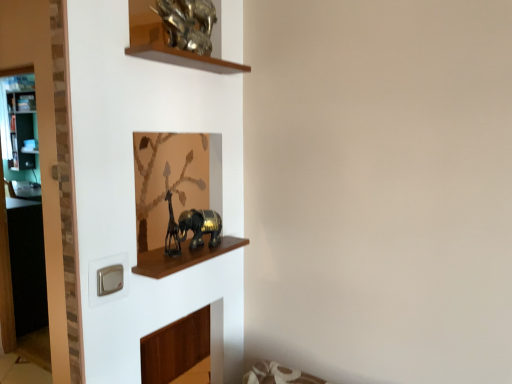
Measure the distance between point (153, 276) and camera.

Point (153, 276) and camera are 1.36 meters apart.

This screenshot has width=512, height=384. Describe the element at coordinates (182, 257) in the screenshot. I see `shiny brown cabinet at center` at that location.

What is the approximate width of gold metallic sculpture at upper center, which is the second animal in bottom-to-top order?

5.25 inches.

What do you see at coordinates (22, 221) in the screenshot? I see `transparent glass door at left` at bounding box center [22, 221].

You are a GUI agent. You are given a task and a screenshot of the screen. Output one action in this format:
    pyautogui.click(x=<x>, y=<y>)
    Task: Click on the shiny brown cabinet at center
    The width and height of the screenshot is (512, 384).
    Given the screenshot: What is the action you would take?
    pyautogui.click(x=182, y=257)

Can you tell me how much transparent glass door at left and shiny brown cabinet at center differ in facing direction?

89.6 degrees separate the facing orientations of transparent glass door at left and shiny brown cabinet at center.

Is transparent glass door at left positioned with its back to shiny brown cabinet at center?

Result: No, transparent glass door at left's orientation is not away from shiny brown cabinet at center.

Which is behind, transparent glass door at left or shiny brown cabinet at center?

transparent glass door at left is further from the camera.

From a real-world perspective, is transparent glass door at left under shiny brown cabinet at center?

Yes, from a real-world perspective, transparent glass door at left is beneath shiny brown cabinet at center.

Is transparent glass door at left spatially inside gold metallic sculpture at upper center, which is the second animal in bottom-to-top order, or outside of it?

transparent glass door at left exists outside the volume of gold metallic sculpture at upper center, which is the second animal in bottom-to-top order.

Is transparent glass door at left far from gold metallic sculpture at upper center, which is the second animal in bottom-to-top order?

Yes, transparent glass door at left and gold metallic sculpture at upper center, which is the second animal in bottom-to-top order, are located far from each other.

From the image's perspective, is transparent glass door at left positioned above or below gold metallic sculpture at upper center, which ranks as the 1th animal in top-to-bottom order?

transparent glass door at left is situated lower than gold metallic sculpture at upper center, which ranks as the 1th animal in top-to-bottom order, in the image.

Considering the sizes of objects transparent glass door at left and gold metallic sculpture at upper center, which is the second animal in bottom-to-top order, in the image provided, who is wider, transparent glass door at left or gold metallic sculpture at upper center, which is the second animal in bottom-to-top order,?

transparent glass door at left.

From the picture: Which of these two, shiny brown cabinet at center or gold metallic sculpture at upper center, which ranks as the 1th animal in top-to-bottom order, is wider?

Wider between the two is gold metallic sculpture at upper center, which ranks as the 1th animal in top-to-bottom order.

Is shiny brown cabinet at center bigger than gold metallic sculpture at upper center, which is the second animal in bottom-to-top order?

No, shiny brown cabinet at center is not bigger than gold metallic sculpture at upper center, which is the second animal in bottom-to-top order.

Based on the photo, is shiny brown cabinet at center positioned with its back to gold metallic sculpture at upper center, which is the second animal in bottom-to-top order?

That's not correct — shiny brown cabinet at center is not looking away from gold metallic sculpture at upper center, which is the second animal in bottom-to-top order.

How far apart are shiny brown cabinet at center and gold metallic sculpture at upper center, which is the second animal in bottom-to-top order?

28.27 inches.

From the picture: How far apart are gold metallic elephant at center, the second animal positioned from the top, and gold metallic sculpture at upper center, which is the second animal in bottom-to-top order?

62.12 centimeters.

Does gold metallic elephant at center, acting as the 1th animal starting from the bottom, have a lesser width compared to gold metallic sculpture at upper center, which ranks as the 1th animal in top-to-bottom order?

Yes.

Is the surface of gold metallic elephant at center, the second animal positioned from the top, in direct contact with gold metallic sculpture at upper center, which ranks as the 1th animal in top-to-bottom order?

gold metallic elephant at center, the second animal positioned from the top, and gold metallic sculpture at upper center, which ranks as the 1th animal in top-to-bottom order, are clearly separated.

From a real-world perspective, is gold metallic elephant at center, the second animal positioned from the top, on gold metallic sculpture at upper center, which is the second animal in bottom-to-top order?

No, from a real-world perspective, gold metallic elephant at center, the second animal positioned from the top, is not over gold metallic sculpture at upper center, which is the second animal in bottom-to-top order

Is transparent glass door at left facing away from gold metallic elephant at center, acting as the 1th animal starting from the bottom?

transparent glass door at left is not turned away from gold metallic elephant at center, acting as the 1th animal starting from the bottom.

Is transparent glass door at left situated inside gold metallic elephant at center, the second animal positioned from the top, or outside?

transparent glass door at left is located beyond the bounds of gold metallic elephant at center, the second animal positioned from the top.

Considering their positions, is transparent glass door at left located in front of or behind gold metallic elephant at center, acting as the 1th animal starting from the bottom?

Clearly, transparent glass door at left is behind gold metallic elephant at center, acting as the 1th animal starting from the bottom.

Where is `glass door that appears behind the gold metallic elephant at center, the second animal positioned from the top`? glass door that appears behind the gold metallic elephant at center, the second animal positioned from the top is located at coordinates (22, 221).

Is point (182, 232) positioned behind point (151, 259)?

No.

Between gold metallic elephant at center, acting as the 1th animal starting from the bottom, and shiny brown cabinet at center, which one has larger size?

Bigger between the two is gold metallic elephant at center, acting as the 1th animal starting from the bottom.

Is gold metallic elephant at center, acting as the 1th animal starting from the bottom, positioned with its back to shiny brown cabinet at center?

No, gold metallic elephant at center, acting as the 1th animal starting from the bottom, is not facing away from shiny brown cabinet at center.

Can you confirm if gold metallic elephant at center, acting as the 1th animal starting from the bottom, is positioned to the right of shiny brown cabinet at center?

Yes, gold metallic elephant at center, acting as the 1th animal starting from the bottom, is to the right of shiny brown cabinet at center.

Would you consider gold metallic sculpture at upper center, which ranks as the 1th animal in top-to-bottom order, to be distant from transparent glass door at left?

Yes.

This screenshot has width=512, height=384. What are the coordinates of `glass door below the gold metallic sculpture at upper center, which ranks as the 1th animal in top-to-bottom order (from a real-world perspective)` in the screenshot? It's located at (22, 221).

Considering the positions of objects gold metallic sculpture at upper center, which ranks as the 1th animal in top-to-bottom order, and transparent glass door at left in the image provided, who is more to the left, gold metallic sculpture at upper center, which ranks as the 1th animal in top-to-bottom order, or transparent glass door at left?

transparent glass door at left is more to the left.

Image resolution: width=512 pixels, height=384 pixels. I want to click on glass door that appears on the left of shiny brown cabinet at center, so click(22, 221).

You are a GUI agent. You are given a task and a screenshot of the screen. Output one action in this format:
    pyautogui.click(x=<x>, y=<y>)
    Task: Click on the animal that is the 1st one when counting rightward from the transparent glass door at left
    
    Given the screenshot: What is the action you would take?
    pyautogui.click(x=188, y=23)

From the image, which object appears to be nearer to transparent glass door at left, gold metallic elephant at center, acting as the 1th animal starting from the bottom, or gold metallic sculpture at upper center, which is the second animal in bottom-to-top order?

The object closer to transparent glass door at left is gold metallic elephant at center, acting as the 1th animal starting from the bottom.

Looking at the image, which one is located further to gold metallic sculpture at upper center, which ranks as the 1th animal in top-to-bottom order, gold metallic elephant at center, the second animal positioned from the top, or shiny brown cabinet at center?

shiny brown cabinet at center is positioned further to the anchor gold metallic sculpture at upper center, which ranks as the 1th animal in top-to-bottom order.

From the image, which object appears to be nearer to gold metallic elephant at center, the second animal positioned from the top, transparent glass door at left or gold metallic sculpture at upper center, which ranks as the 1th animal in top-to-bottom order?

gold metallic sculpture at upper center, which ranks as the 1th animal in top-to-bottom order, is positioned closer to the anchor gold metallic elephant at center, the second animal positioned from the top.

Looking at the image, which one is located closer to gold metallic elephant at center, the second animal positioned from the top, shiny brown cabinet at center or transparent glass door at left?

shiny brown cabinet at center is positioned closer to the anchor gold metallic elephant at center, the second animal positioned from the top.

Which object lies nearer to the anchor point gold metallic elephant at center, acting as the 1th animal starting from the bottom, gold metallic sculpture at upper center, which is the second animal in bottom-to-top order, or shiny brown cabinet at center?

Based on the image, shiny brown cabinet at center appears to be nearer to gold metallic elephant at center, acting as the 1th animal starting from the bottom.

Looking at the image, which one is located further to shiny brown cabinet at center, gold metallic elephant at center, the second animal positioned from the top, or gold metallic sculpture at upper center, which ranks as the 1th animal in top-to-bottom order?

gold metallic sculpture at upper center, which ranks as the 1th animal in top-to-bottom order, lies further to shiny brown cabinet at center than the other object.

Considering their positions, is transparent glass door at left positioned further to gold metallic sculpture at upper center, which ranks as the 1th animal in top-to-bottom order, than gold metallic elephant at center, acting as the 1th animal starting from the bottom?

The object further to gold metallic sculpture at upper center, which ranks as the 1th animal in top-to-bottom order, is transparent glass door at left.

From the image, which object appears to be farther from gold metallic elephant at center, the second animal positioned from the top, transparent glass door at left or shiny brown cabinet at center?

transparent glass door at left.

Find the location of a particular element. animal located between transparent glass door at left and gold metallic elephant at center, acting as the 1th animal starting from the bottom, in the left-right direction is located at coordinates (188, 23).

This screenshot has height=384, width=512. What are the coordinates of `animal between gold metallic sculpture at upper center, which ranks as the 1th animal in top-to-bottom order, and shiny brown cabinet at center in the up-down direction` in the screenshot? It's located at (200, 226).

The width and height of the screenshot is (512, 384). I want to click on cabinet between transparent glass door at left and gold metallic elephant at center, the second animal positioned from the top, from left to right, so click(182, 257).